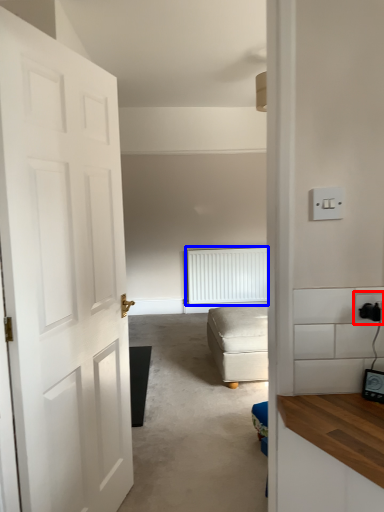
Question: Which object is further to the camera taking this photo, electric outlet (highlighted by a red box) or radiator (highlighted by a blue box)?

Choices:
 (A) electric outlet
 (B) radiator

Answer: (B)